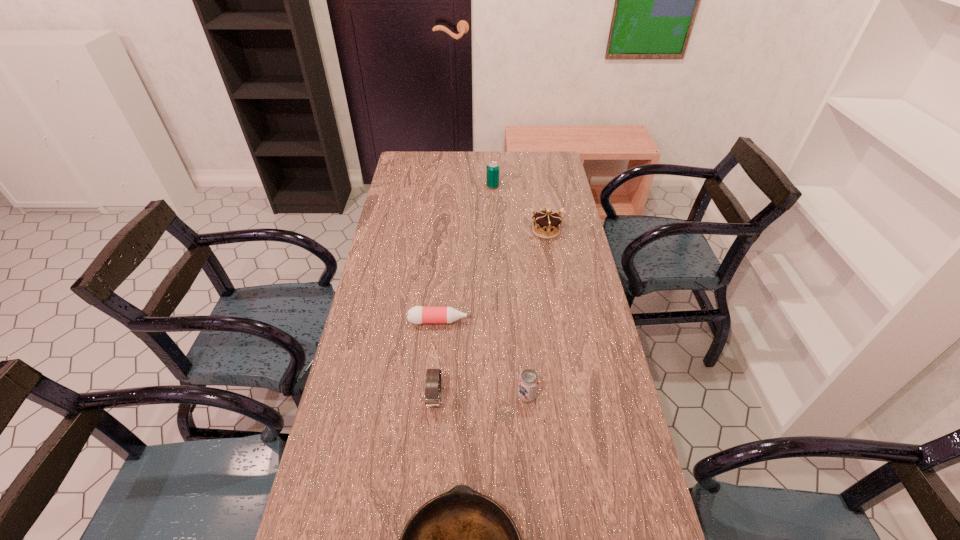
This screenshot has height=540, width=960. What are the coordinates of `free space located on the back of the shorter beer can` in the screenshot? It's located at (521, 329).

Where is `free location located 0.090m with the cap open on the bottle`? Image resolution: width=960 pixels, height=540 pixels. free location located 0.090m with the cap open on the bottle is located at coordinates (499, 321).

I want to click on object positioned at the left edge, so click(418, 314).

Locate an element on the screen. The height and width of the screenshot is (540, 960). object present at the right edge is located at coordinates (546, 224).

Locate an element on the screen. This screenshot has width=960, height=540. vacant area at the far edge of the desktop is located at coordinates (489, 158).

At what (x,y) coordinates should I click in order to perform the action: click on free region at the left edge of the desktop. Please return your answer as a coordinate pair (x, y). Image resolution: width=960 pixels, height=540 pixels. Looking at the image, I should click on (354, 379).

Find the location of a particular element. The image size is (960, 540). vacant region at the right edge of the desktop is located at coordinates (x=574, y=347).

This screenshot has height=540, width=960. Identify the location of vacant space at the far left corner of the desktop. (432, 166).

In order to click on vacant space at the far right corner in this screenshot , I will do `click(556, 160)`.

Find the location of `unoccupied position between the third farthest object and the shorter beer can`. unoccupied position between the third farthest object and the shorter beer can is located at coordinates (484, 358).